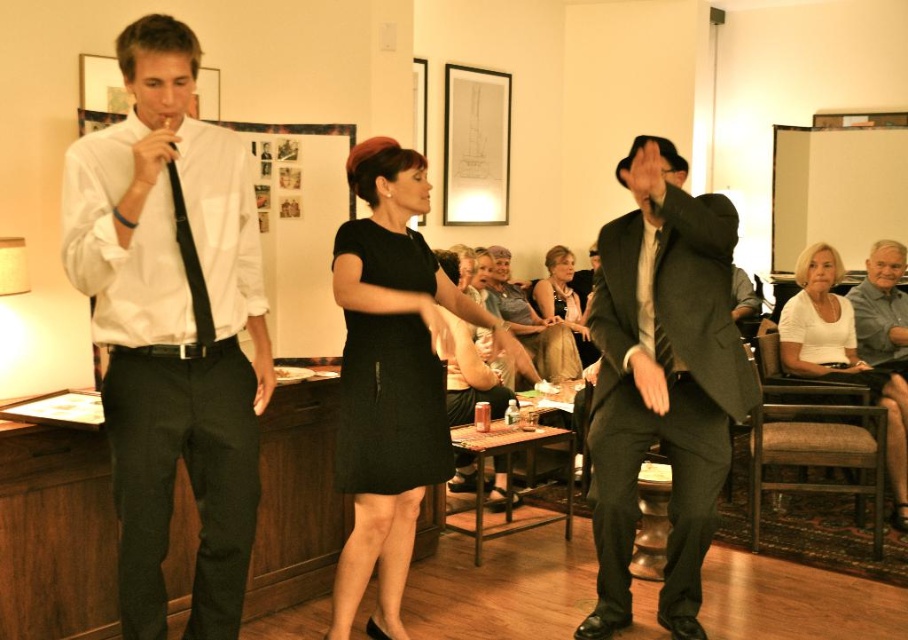
Question: Which of the following is the farthest from the observer?

Choices:
 (A) (227, 419)
 (B) (396, 381)
 (C) (383, 484)
 (D) (619, 168)

Answer: (D)

Question: Which object is farther from the camera taking this photo?

Choices:
 (A) matte black tie at left
 (B) black matte dress at center

Answer: (B)

Question: Does matte black tie at left appear on the right side of matte black dress at center?

Choices:
 (A) no
 (B) yes

Answer: (A)

Question: Is white cotton shirt at lower right wider than black satin tie at left?

Choices:
 (A) yes
 (B) no

Answer: (A)

Question: Which object appears farthest from the camera in this image?

Choices:
 (A) black silk tie at center
 (B) matte black tie at left
 (C) white cotton shirt at lower right
 (D) matte black dress at center

Answer: (D)

Question: Does matte black suit at center have a larger size compared to black satin tie at left?

Choices:
 (A) no
 (B) yes

Answer: (B)